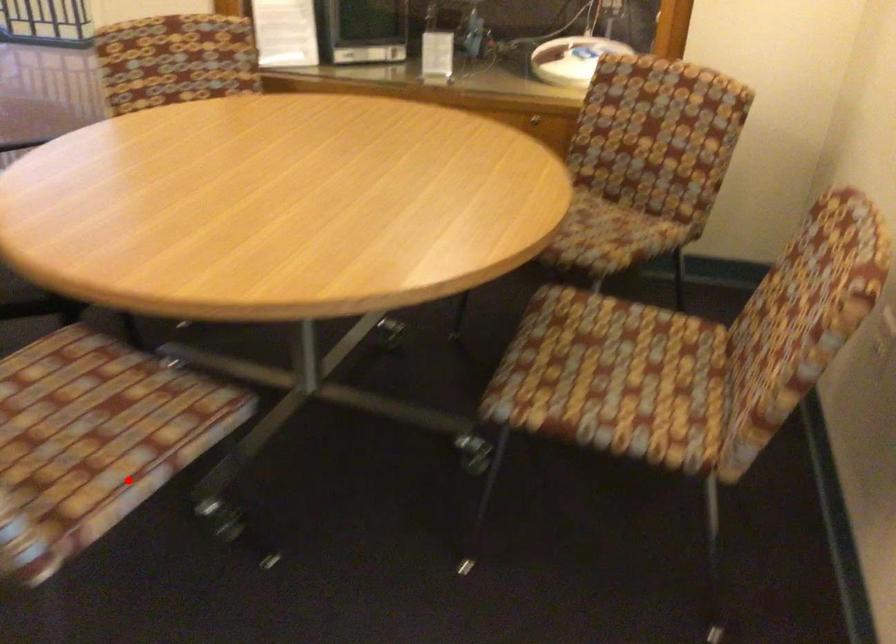
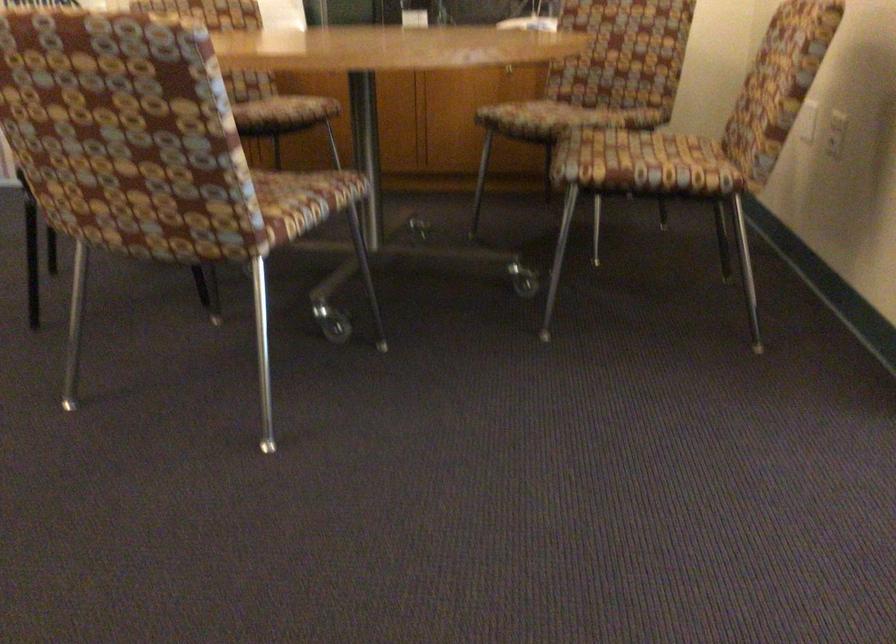
Question: I am providing you with two images of the same scene from different viewpoints. In image1, a red point is highlighted. Considering the same 3D point in image2, which of the following is correct?

Choices:
 (A) It is closer
 (B) It is farther

Answer: (B)